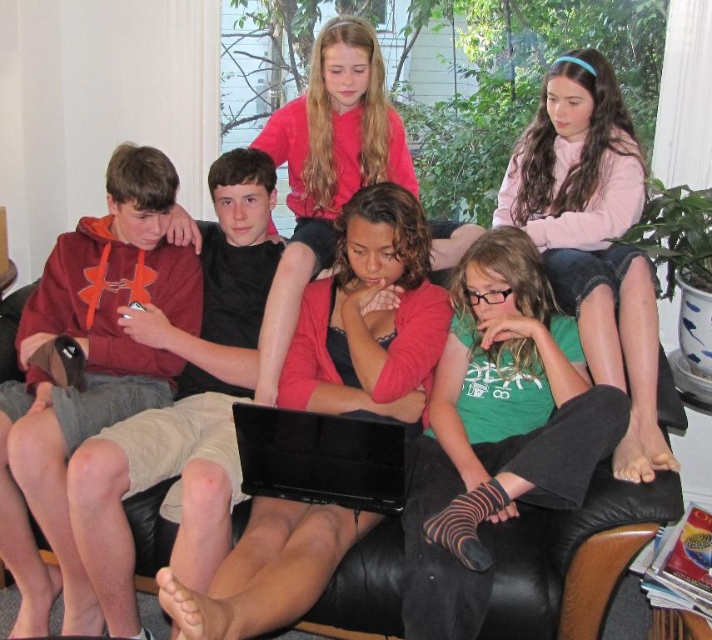
Between black leather couch at center and black glossy laptop at center, which one is positioned higher?

black glossy laptop at center is above.

Does black leather couch at center have a greater width compared to black glossy laptop at center?

Correct, the width of black leather couch at center exceeds that of black glossy laptop at center.

Between point (379, 534) and point (293, 412), which one is positioned in front?

Point (293, 412) is in front.

The height and width of the screenshot is (640, 712). Find the location of `black leather couch at center`. black leather couch at center is located at coordinates (562, 548).

Is point (287, 387) positioned in front of point (612, 596)?

No.

Between point (417, 348) and point (152, 541), which one is positioned in front?

Point (152, 541)

Between point (179, 634) and point (387, 532), which one is positioned behind?

The point (387, 532) is behind.

This screenshot has width=712, height=640. I want to click on matte black laptop at center, so click(370, 316).

In order to click on matte black laptop at center in this screenshot , I will do `click(370, 316)`.

Between point (392, 346) and point (570, 221), which one is positioned behind?

Positioned behind is point (570, 221).

Locate an element on the screen. The image size is (712, 640). matte black laptop at center is located at coordinates (370, 316).